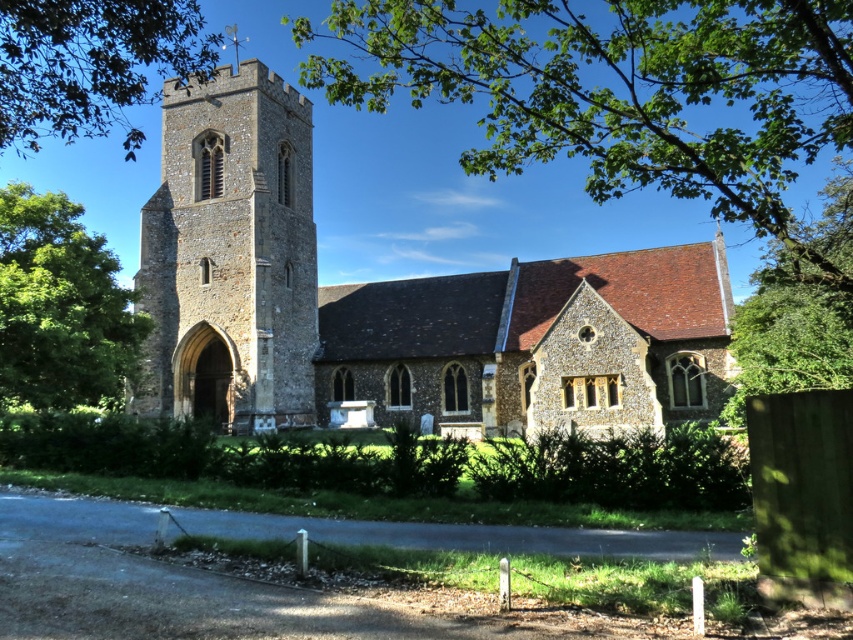
Question: Considering the real-world distances, which object is farthest from the stone tower at center?

Choices:
 (A) green leafy tree at left
 (B) green leafy tree at upper left
 (C) stone church at center

Answer: (B)

Question: Can you confirm if stone tower at center is smaller than green leafy tree at upper left?

Choices:
 (A) yes
 (B) no

Answer: (A)

Question: Among these objects, which one is farthest from the camera?

Choices:
 (A) stone church at center
 (B) green leafy tree at left
 (C) green leafy tree at upper left

Answer: (A)

Question: Does stone church at center appear on the right side of stone tower at center?

Choices:
 (A) yes
 (B) no

Answer: (A)

Question: Considering the real-world distances, which object is closest to the stone tower at center?

Choices:
 (A) green leafy tree at upper left
 (B) stone church at center

Answer: (B)

Question: Is stone tower at center to the left of green leafy tree at upper left from the viewer's perspective?

Choices:
 (A) no
 (B) yes

Answer: (A)